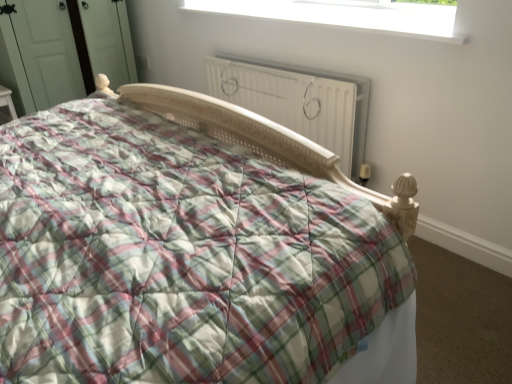
Where is `plaid fabric bed at center`? Image resolution: width=512 pixels, height=384 pixels. plaid fabric bed at center is located at coordinates (191, 252).

In order to face white plastic window at upper center, should I rotate leftwards or rightwards?

Rotate your view right by about 7.123°.

This screenshot has height=384, width=512. Find the location of `white matte radiator at center`. white matte radiator at center is located at coordinates (298, 101).

I want to click on plaid fabric bed at center, so click(x=191, y=252).

Can you confirm if white matte radiator at center is wider than plaid fabric bed at center?

In fact, white matte radiator at center might be narrower than plaid fabric bed at center.

The width and height of the screenshot is (512, 384). Identify the location of radiator that appears above the plaid fabric bed at center (from the image's perspective). [298, 101].

Consider the image. From the image's perspective, is white matte radiator at center located above or below plaid fabric bed at center?

From the image's perspective, white matte radiator at center appears above plaid fabric bed at center.

From a real-world perspective, is white matte radiator at center on top of plaid fabric bed at center?

Actually, white matte radiator at center is physically below plaid fabric bed at center in the real world.

Is white plastic window at upper center wider than plaid fabric bed at center?

In fact, white plastic window at upper center might be narrower than plaid fabric bed at center.

From their relative heights in the image, would you say white plastic window at upper center is taller or shorter than plaid fabric bed at center?

white plastic window at upper center is shorter than plaid fabric bed at center.

Considering the positions of point (389, 7) and point (118, 303), is point (389, 7) closer or farther from the camera than point (118, 303)?

Clearly, point (389, 7) is more distant from the camera than point (118, 303).

Do you think white plastic window at upper center is within plaid fabric bed at center, or outside of it?

white plastic window at upper center cannot be found inside plaid fabric bed at center.

Locate an element on the screen. This screenshot has width=512, height=384. window above the white matte radiator at center (from a real-world perspective) is located at coordinates (347, 15).

Is white plastic window at upper center touching white matte radiator at center?

No, white plastic window at upper center is not next to white matte radiator at center.

Can you confirm if white plastic window at upper center is thinner than white matte radiator at center?

No.

How different are the orientations of white plastic window at upper center and white matte radiator at center in degrees?

The angle between the facing direction of white plastic window at upper center and the facing direction of white matte radiator at center is 0.00386 degrees.

Which is more to the right, plaid fabric bed at center or white plastic window at upper center?

From the viewer's perspective, white plastic window at upper center appears more on the right side.

Choose the correct answer: Is plaid fabric bed at center inside white plastic window at upper center or outside it?

plaid fabric bed at center is not enclosed by white plastic window at upper center.

Considering the positions of point (220, 183) and point (401, 14), is point (220, 183) closer or farther from the camera than point (401, 14)?

Clearly, point (220, 183) is closer to the camera than point (401, 14).

From a real-world perspective, does plaid fabric bed at center stand above white plastic window at upper center?

No, from a real-world perspective, plaid fabric bed at center is not over white plastic window at upper center

From their relative heights in the image, would you say white matte radiator at center is taller or shorter than white plastic window at upper center?

white matte radiator at center is taller than white plastic window at upper center.

Would you say white matte radiator at center contains white plastic window at upper center?

No, white plastic window at upper center is not surrounded by white matte radiator at center.

This screenshot has height=384, width=512. Identify the location of radiator to the left of white plastic window at upper center. (298, 101).

Is plaid fabric bed at center situated inside white matte radiator at center or outside?

plaid fabric bed at center is outside white matte radiator at center.

In the scene shown: From a real-world perspective, who is located lower, plaid fabric bed at center or white matte radiator at center?

white matte radiator at center.

From the image's perspective, relative to white matte radiator at center, is plaid fabric bed at center above or below?

Based on their image positions, plaid fabric bed at center is located beneath white matte radiator at center.

Measure the distance from plaid fabric bed at center to white matte radiator at center.

plaid fabric bed at center is 1.00 meters away from white matte radiator at center.

The width and height of the screenshot is (512, 384). I want to click on radiator directly beneath the plaid fabric bed at center (from a real-world perspective), so click(x=298, y=101).

Identify the location of bed lying in front of the white plastic window at upper center. (191, 252).

Estimate the real-world distances between objects in this image. Which object is further from plaid fabric bed at center, white matte radiator at center or white plastic window at upper center?

white plastic window at upper center lies further to plaid fabric bed at center than the other object.

Looking at the image, which one is located further to white plastic window at upper center, plaid fabric bed at center or white matte radiator at center?

plaid fabric bed at center is further to white plastic window at upper center.

From the image, which object appears to be nearer to white plastic window at upper center, white matte radiator at center or plaid fabric bed at center?

white matte radiator at center is positioned closer to the anchor white plastic window at upper center.

Consider the image. Based on their spatial positions, is plaid fabric bed at center or white plastic window at upper center further from white matte radiator at center?

Among the two, plaid fabric bed at center is located further to white matte radiator at center.

Estimate the real-world distances between objects in this image. Which object is further from white matte radiator at center, white plastic window at upper center or plaid fabric bed at center?

plaid fabric bed at center lies further to white matte radiator at center than the other object.

Looking at the image, which one is located closer to plaid fabric bed at center, white plastic window at upper center or white matte radiator at center?

white matte radiator at center is positioned closer to the anchor plaid fabric bed at center.

Where is `window between plaid fabric bed at center and white matte radiator at center in the front-back direction`? window between plaid fabric bed at center and white matte radiator at center in the front-back direction is located at coordinates (347, 15).